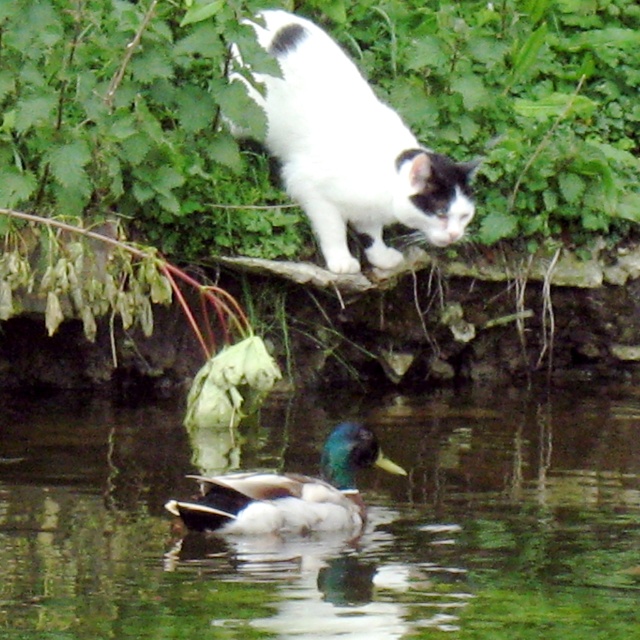
Who is more distant from viewer, (1, 522) or (72, 154)?

Positioned behind is point (72, 154).

How distant is white fluffy duck at lower center from green leafy vegetation at upper center?

white fluffy duck at lower center and green leafy vegetation at upper center are 1.40 meters apart.

What do you see at coordinates (333, 538) in the screenshot?
I see `white fluffy duck at lower center` at bounding box center [333, 538].

Locate an element on the screen. white fluffy duck at lower center is located at coordinates (333, 538).

Based on the photo, can you confirm if white fur cat at upper center is bigger than green glossy duck at lower center?

Correct, white fur cat at upper center is larger in size than green glossy duck at lower center.

Can you confirm if white fur cat at upper center is smaller than green glossy duck at lower center?

Incorrect, white fur cat at upper center is not smaller in size than green glossy duck at lower center.

Is point (314, 204) positioned behind point (364, 520)?

Yes, point (314, 204) is behind point (364, 520).

You are a GUI agent. You are given a task and a screenshot of the screen. Output one action in this format:
    pyautogui.click(x=<x>, y=<y>)
    Task: Click on the white fur cat at upper center
    The width and height of the screenshot is (640, 640).
    Given the screenshot: What is the action you would take?
    pyautogui.click(x=349, y=150)

Can you confirm if green leafy vegetation at upper center is thinner than green glossy duck at lower center?

In fact, green leafy vegetation at upper center might be wider than green glossy duck at lower center.

Which is above, green leafy vegetation at upper center or green glossy duck at lower center?

green leafy vegetation at upper center is higher up.

Where is `green leafy vegetation at upper center`? green leafy vegetation at upper center is located at coordinates (134, 122).